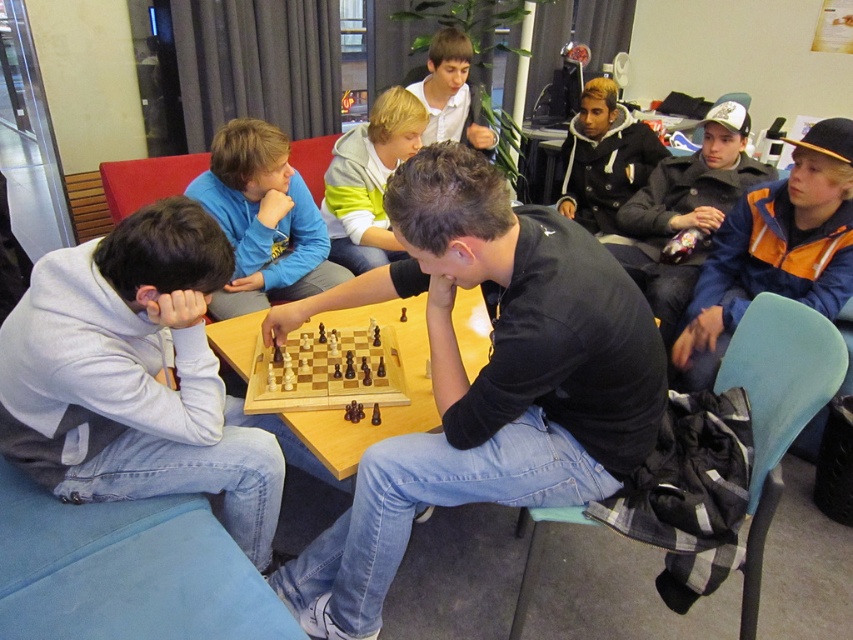
You are a photographer trying to capture a photo of the wooden chessboard at center without including the gray fleece hoodie at left in the frame. Based on their positions, is this possible?

The gray fleece hoodie at left is positioned on the left side of wooden chessboard at center, so if you move to the right side of the chessboard, you can frame the shot to exclude the hoodie.

You are a photographer trying to capture a group photo of the scene. You notice the blue fleece jacket at upper left and the light gray hoodie at center. Which of these two items should you adjust to ensure all subjects are visible in the photo?

The blue fleece jacket at upper left is shorter than the light gray hoodie at center. To ensure all subjects are visible, you should lower the blue fleece jacket at upper left so it doesn